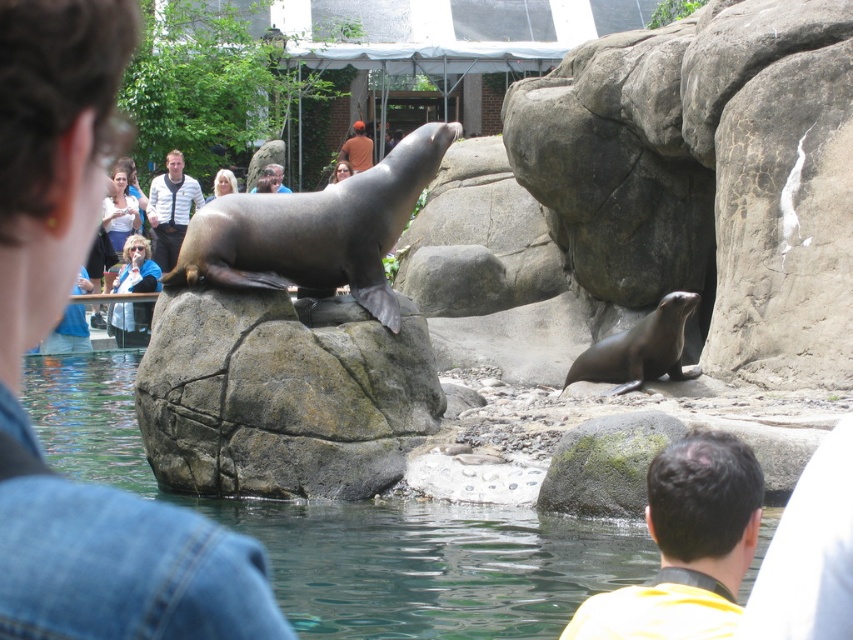
You are a zookeeper preparing to distribute towels to visitors. You have two towels, one placed on the yellow fabric at center and another on the brown leather jacket at upper center. Which towel should you take if you need the larger one?

The yellow fabric at center is larger in size than the brown leather jacket at upper center, so you should take the towel on the yellow fabric at center.

Consider the image. You are a zookeeper preparing to place a new yellow fabric at center on the ground next to the brown leather jacket at upper center. Considering their sizes, which object will require more space horizontally?

The yellow fabric at center requires more horizontal space since its width surpasses that of the brown leather jacket at upper center.

You are a zookeeper planning to place a new feeding station between the clear water at lower center and the yellow fabric at center. Based on their positions, which object should the feeding station be closer to?

The clear water at lower center is to the left of yellow fabric at center, so the feeding station should be placed closer to the yellow fabric at center since it is on the right side.